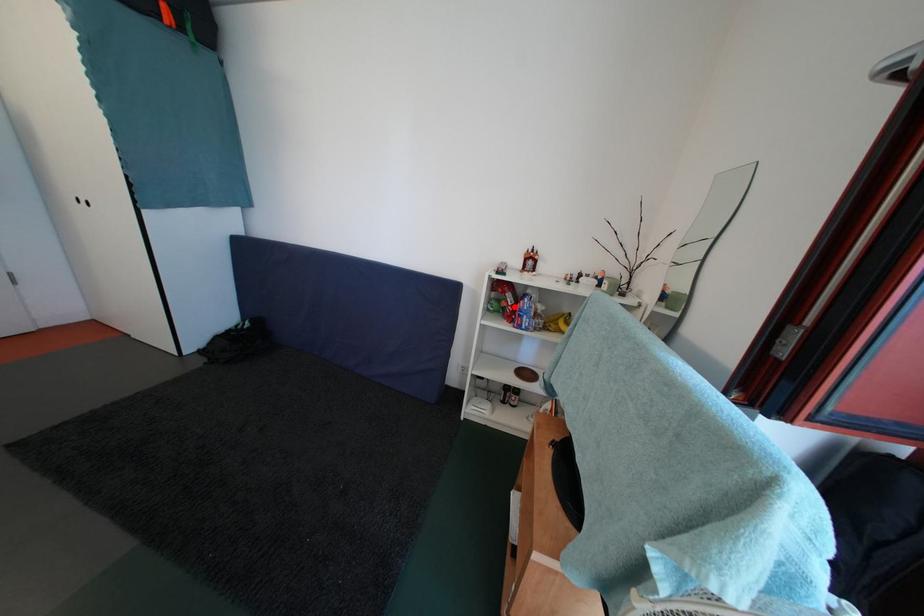
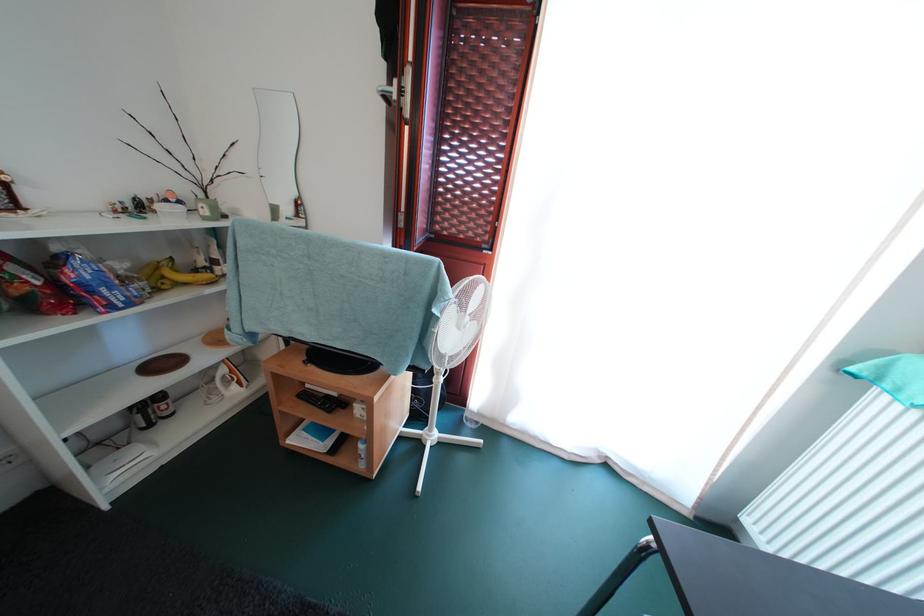
Question: I am providing you with two images of the same scene from different viewpoints. Given a red point in image1, look at the same physical point in image2. Is it:

Choices:
 (A) Closer to the viewpoint
 (B) Farther from the viewpoint

Answer: (B)